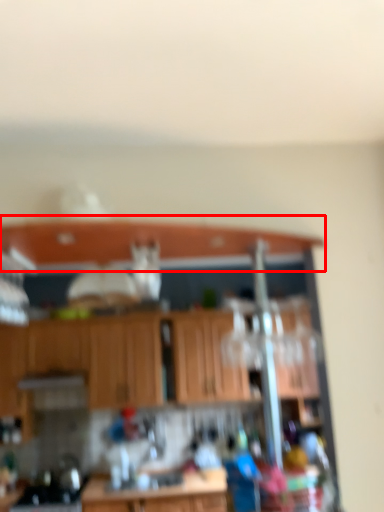
Question: From the image's perspective, where is window sill (annotated by the red box) located in relation to cabinetry in the image?

Choices:
 (A) above
 (B) below

Answer: (A)